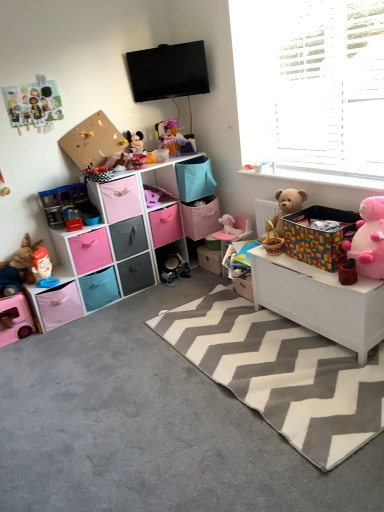
Locate an element on the screen. The width and height of the screenshot is (384, 512). free space in front of pink fabric storage box at lower left, arranged as the first storage box when viewed from the left is located at coordinates 52,343.